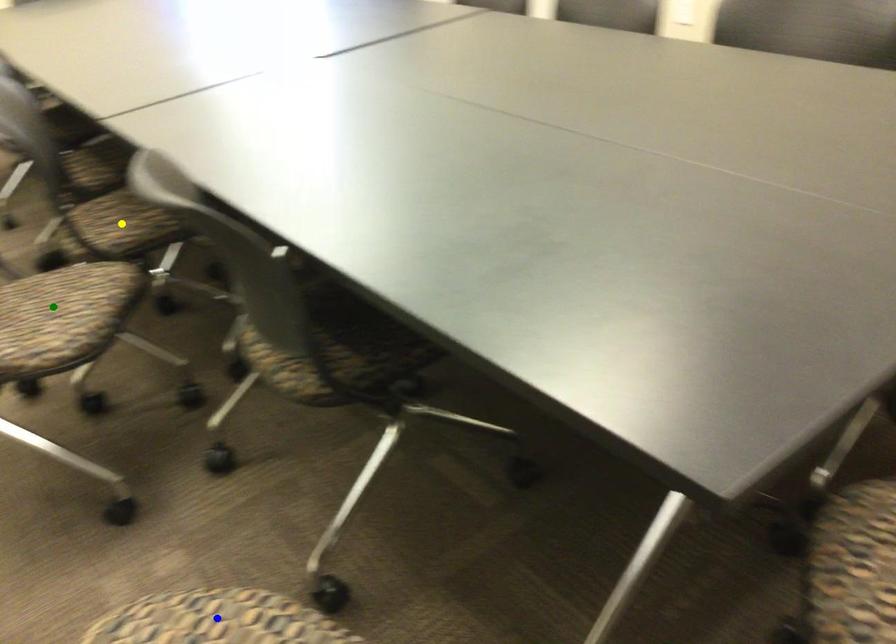
Order these from nearest to farthest:
yellow point, green point, blue point

yellow point < green point < blue point